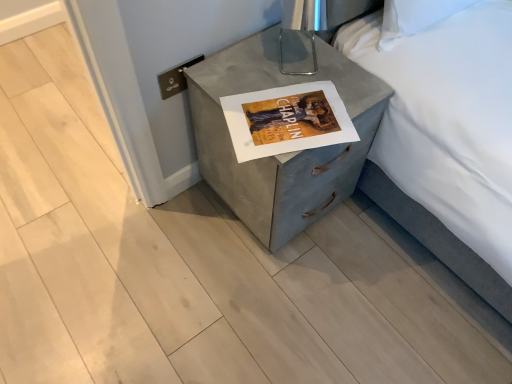
Locate an element on the screen. Image resolution: width=512 pixels, height=384 pixels. vacant space to the left of concrete side table at center is located at coordinates (173, 230).